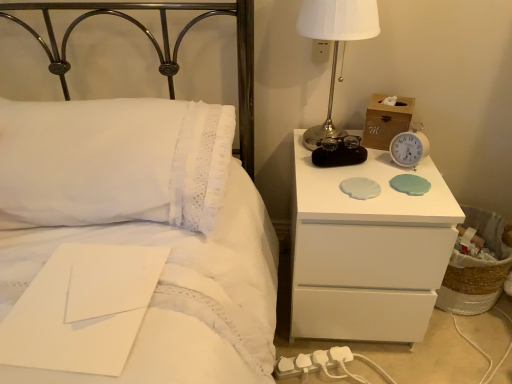
The height and width of the screenshot is (384, 512). I want to click on free space above white glossy nightstand at right (from a real-world perspective), so click(376, 181).